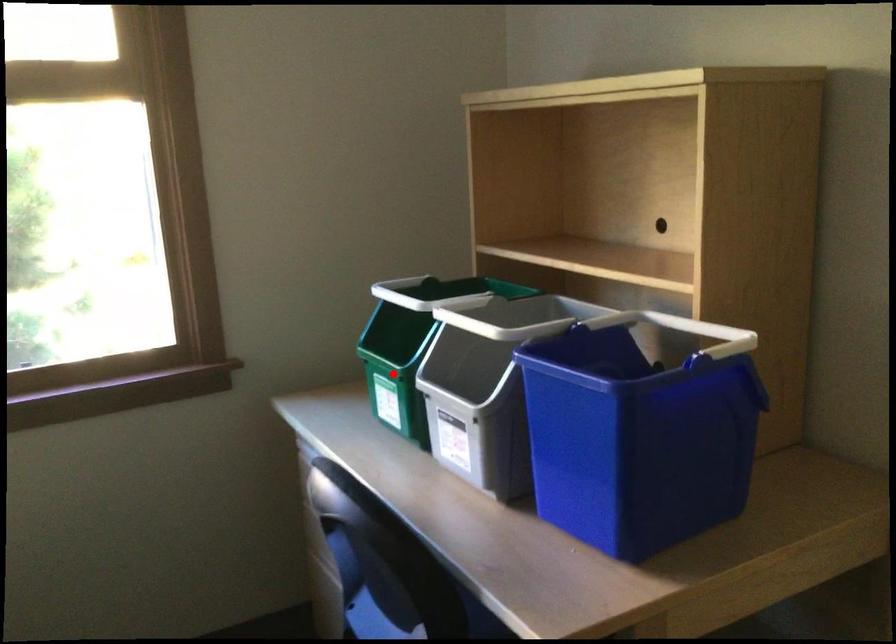
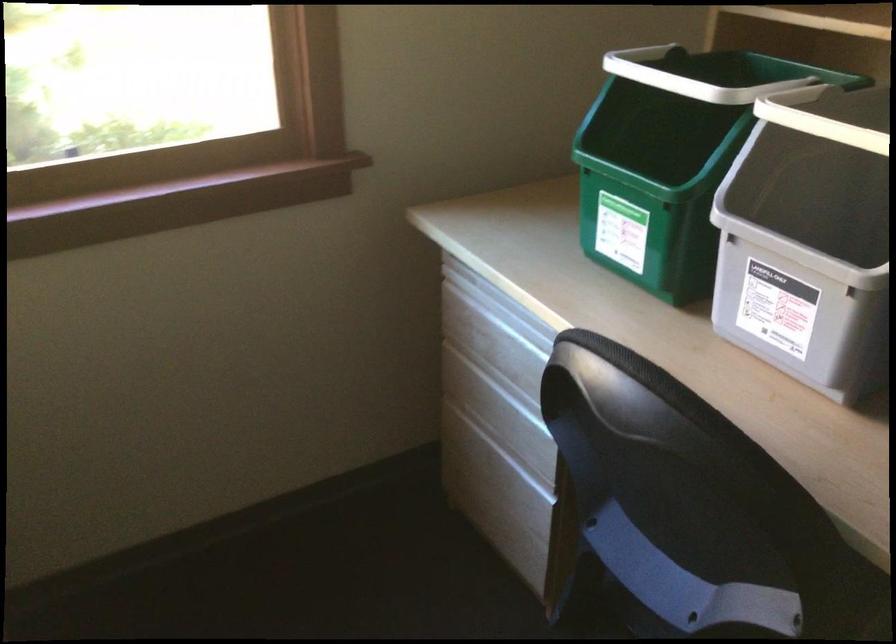
Question: I am providing you with two images of the same scene from different viewpoints. A red point is shown in image1. For the corresponding object point in image2, is it positioned nearer or farther from the camera?

Choices:
 (A) Nearer
 (B) Farther

Answer: (A)